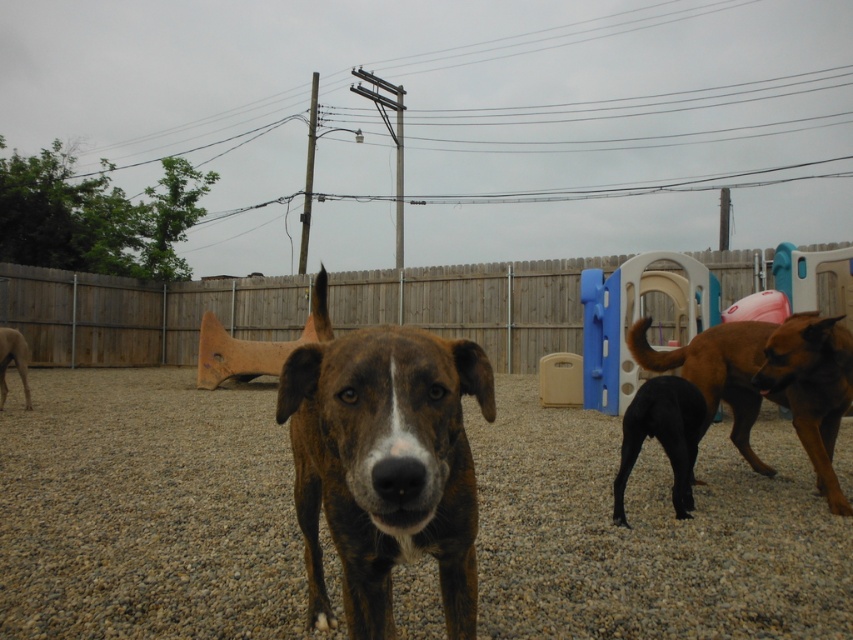
Consider the image. Is brown brindle dog at center bigger than black matte dog at right?

Indeed, brown brindle dog at center has a larger size compared to black matte dog at right.

Where is `brown brindle dog at center`? The image size is (853, 640). brown brindle dog at center is located at coordinates (384, 464).

Locate an element on the screen. This screenshot has width=853, height=640. brown brindle dog at center is located at coordinates (384, 464).

Looking at this image, is black matte dog at right wider than brown brindle dog at left?

Yes, black matte dog at right is wider than brown brindle dog at left.

Is black matte dog at right shorter than brown brindle dog at left?

Correct, black matte dog at right is not as tall as brown brindle dog at left.

Who is more forward, (624, 508) or (21, 358)?

Positioned in front is point (624, 508).

Find the location of a particular element. black matte dog at right is located at coordinates (662, 436).

In the scene shown: Which is below, wooden fence at center or black matte dog at right?

Positioned lower is black matte dog at right.

Based on the photo, is the position of wooden fence at center less distant than that of black matte dog at right?

No, wooden fence at center is further to the viewer.

Identify the location of wooden fence at center. Image resolution: width=853 pixels, height=640 pixels. (140, 314).

This screenshot has height=640, width=853. I want to click on wooden fence at center, so click(x=140, y=314).